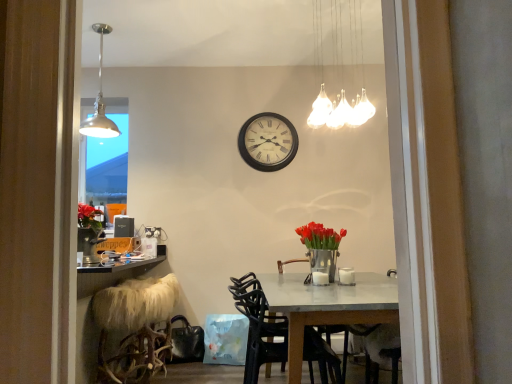
Measure the distance between point (320, 120) and camera.

Point (320, 120) and camera are 13.47 feet apart from each other.

Locate an element on the screen. white glass chandelier at upper center, acting as the 1th lamp starting from the front is located at coordinates (340, 68).

Locate an element on the screen. wooden wall clock at center is located at coordinates (268, 142).

Image resolution: width=512 pixels, height=384 pixels. I want to click on metallic vase with red tulips at center, so click(x=321, y=247).

Between black plastic chair at center and metallic vase with red tulips at center, which one appears on the left side from the viewer's perspective?

From the viewer's perspective, black plastic chair at center appears more on the left side.

Is black plastic chair at center taller than metallic vase with red tulips at center?

Yes, black plastic chair at center is taller than metallic vase with red tulips at center.

From the image's perspective, would you say black plastic chair at center is positioned over metallic vase with red tulips at center?

No, from the image's perspective, black plastic chair at center is not above metallic vase with red tulips at center.

Is metallic pendant light at upper left, marked as the 2th lamp in a front-to-back arrangement, inside the boundaries of fuzzy white stool at lower left, or outside?

metallic pendant light at upper left, marked as the 2th lamp in a front-to-back arrangement, is spatially situated outside fuzzy white stool at lower left.

Based on the photo, from a real-world perspective, is metallic pendant light at upper left, marked as the 2th lamp in a front-to-back arrangement, physically above fuzzy white stool at lower left?

Correct, in the physical world, metallic pendant light at upper left, marked as the 2th lamp in a front-to-back arrangement, is higher than fuzzy white stool at lower left.

Find the location of `lamp located on the left of fuzzy white stool at lower left`. lamp located on the left of fuzzy white stool at lower left is located at coordinates (100, 100).

Which is closer, (96, 104) or (337, 125)?

The point (96, 104) is closer to the camera.

Can you confirm if metallic pendant light at upper left, the first lamp from the left, is smaller than white glass chandelier at upper center, the second lamp in the left-to-right sequence?

Correct, metallic pendant light at upper left, the first lamp from the left, occupies less space than white glass chandelier at upper center, the second lamp in the left-to-right sequence.

How distant is metallic pendant light at upper left, which appears as the 2th lamp when viewed from the right, from white glass chandelier at upper center, placed as the 1th lamp when sorted from right to left?

They are 7.15 feet apart.

From a real-world perspective, is metallic pendant light at upper left, the first lamp from the left, physically located above or below white glass chandelier at upper center, acting as the 1th lamp starting from the front?

metallic pendant light at upper left, the first lamp from the left, is above white glass chandelier at upper center, acting as the 1th lamp starting from the front.

Is there a large distance between black plastic chair at center and wooden wall clock at center?

Yes, black plastic chair at center and wooden wall clock at center are located far from each other.

In the scene shown: From a real-world perspective, between black plastic chair at center and wooden wall clock at center, who is vertically lower?

black plastic chair at center.

Considering the sizes of objects black plastic chair at center and wooden wall clock at center in the image provided, who is thinner, black plastic chair at center or wooden wall clock at center?

wooden wall clock at center is thinner.

Is metallic vase with red tulips at center surrounded by metallic pendant light at upper left, which appears as the 2th lamp when viewed from the right?

Definitely not — metallic vase with red tulips at center is not inside metallic pendant light at upper left, which appears as the 2th lamp when viewed from the right.

How different are the orientations of metallic pendant light at upper left, the first lamp when ordered from back to front, and metallic vase with red tulips at center in degrees?

They differ by 0.00049 degrees in their facing directions.

From the image's perspective, which is above, metallic pendant light at upper left, marked as the 2th lamp in a front-to-back arrangement, or metallic vase with red tulips at center?

From the image's view, metallic pendant light at upper left, marked as the 2th lamp in a front-to-back arrangement, is above.

Identify the location of floral arrangement below the metallic pendant light at upper left, marked as the 2th lamp in a front-to-back arrangement (from the image's perspective). (321, 247).

From the image's perspective, which object appears higher, white glass chandelier at upper center, placed as the 1th lamp when sorted from right to left, or fuzzy white stool at lower left?

From the image's view, white glass chandelier at upper center, placed as the 1th lamp when sorted from right to left, is above.

Between white glass chandelier at upper center, which is counted as the 2th lamp, starting from the back, and fuzzy white stool at lower left, which one has larger width?

With larger width is fuzzy white stool at lower left.

How many degrees apart are the facing directions of white glass chandelier at upper center, placed as the 1th lamp when sorted from right to left, and fuzzy white stool at lower left?

white glass chandelier at upper center, placed as the 1th lamp when sorted from right to left, and fuzzy white stool at lower left are facing 0.000696 degrees away from each other.

Can fuzzy white stool at lower left be found inside white glass chandelier at upper center, which is counted as the 2th lamp, starting from the back?

No.

Is fuzzy white stool at lower left next to metallic vase with red tulips at center and touching it?

fuzzy white stool at lower left and metallic vase with red tulips at center are not in contact.

Does point (157, 356) lie behind point (313, 254)?

Yes, it is.

Can you tell me how much fuzzy white stool at lower left and metallic vase with red tulips at center differ in facing direction?

0.000185 degrees separate the facing orientations of fuzzy white stool at lower left and metallic vase with red tulips at center.

From the picture: Is fuzzy white stool at lower left looking in the opposite direction of metallic vase with red tulips at center?

Correct, fuzzy white stool at lower left is looking away from metallic vase with red tulips at center.

This screenshot has height=384, width=512. I want to click on floral arrangement above the black plastic chair at center (from a real-world perspective), so coord(321,247).

From the image's perspective, count 1st lamps upward from the fuzzy white stool at lower left and point to it. Please provide its 2D coordinates.

[(100, 100)]

Based on their spatial positions, is fuzzy white stool at lower left or black plastic chair at center closer to wooden wall clock at center?

black plastic chair at center is closer to wooden wall clock at center.

Estimate the real-world distances between objects in this image. Which object is closer to metallic vase with red tulips at center, black plastic chair at center or wooden wall clock at center?

Among the two, black plastic chair at center is located nearer to metallic vase with red tulips at center.

Which object lies nearer to the anchor point metallic pendant light at upper left, marked as the 2th lamp in a front-to-back arrangement, black plastic chair at center or metallic vase with red tulips at center?

black plastic chair at center lies closer to metallic pendant light at upper left, marked as the 2th lamp in a front-to-back arrangement, than the other object.

Based on the photo, looking at the image, which one is located further to metallic vase with red tulips at center, fuzzy white stool at lower left or metallic pendant light at upper left, the first lamp from the left?

metallic pendant light at upper left, the first lamp from the left.

Looking at the image, which one is located closer to metallic pendant light at upper left, marked as the 2th lamp in a front-to-back arrangement, metallic vase with red tulips at center or fuzzy white stool at lower left?

Based on the image, fuzzy white stool at lower left appears to be nearer to metallic pendant light at upper left, marked as the 2th lamp in a front-to-back arrangement.

Consider the image. Considering their positions, is black plastic chair at center positioned further to white glass chandelier at upper center, placed as the 1th lamp when sorted from right to left, than wooden wall clock at center?

black plastic chair at center.

When comparing their distances from wooden wall clock at center, does metallic pendant light at upper left, marked as the 2th lamp in a front-to-back arrangement, or fuzzy white stool at lower left seem closer?

The object closer to wooden wall clock at center is metallic pendant light at upper left, marked as the 2th lamp in a front-to-back arrangement.

When comparing their distances from metallic pendant light at upper left, which appears as the 2th lamp when viewed from the right, does metallic vase with red tulips at center or wooden wall clock at center seem further?

metallic vase with red tulips at center.

At what (x,y) coordinates should I click in order to perform the action: click on floral arrangement that lies between metallic pendant light at upper left, the first lamp from the left, and fuzzy white stool at lower left from top to bottom. Please return your answer as a coordinate pair (x, y). Looking at the image, I should click on (321, 247).

Locate an element on the screen. floral arrangement between white glass chandelier at upper center, the second lamp in the left-to-right sequence, and wooden wall clock at center in the front-back direction is located at coordinates (321, 247).

In order to click on floral arrangement between metallic pendant light at upper left, marked as the 2th lamp in a front-to-back arrangement, and white glass chandelier at upper center, the second lamp in the left-to-right sequence in this screenshot , I will do `click(321, 247)`.

This screenshot has width=512, height=384. In order to click on lamp that lies between white glass chandelier at upper center, the second lamp in the left-to-right sequence, and black plastic chair at center from top to bottom in this screenshot , I will do `click(100, 100)`.